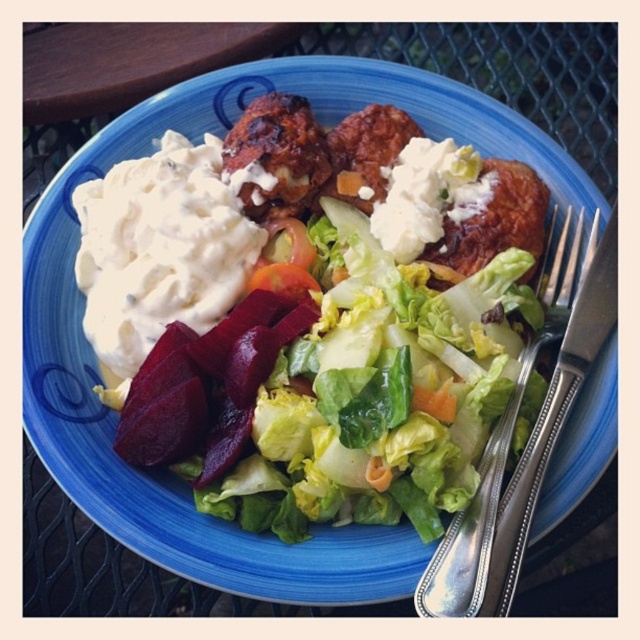
Which is in front, point (420, 312) or point (333, 188)?

Point (420, 312) is more forward.

Can you confirm if matte green lettuce at center is thinner than brown crispy meat at center?

Incorrect, matte green lettuce at center's width is not less than brown crispy meat at center's.

This screenshot has width=640, height=640. I want to click on matte green lettuce at center, so click(x=332, y=387).

Is the position of matte green lettuce at center less distant than that of slightly charred meat at center?

Yes, matte green lettuce at center is in front of slightly charred meat at center.

Does point (196, 484) come behind point (468, 256)?

That is False.

At what (x,y) coordinates should I click in order to perform the action: click on matte green lettuce at center. Please return your answer as a coordinate pair (x, y). Looking at the image, I should click on (332, 387).

Based on the photo, is silver plated fork at right positioned in front of orange smooth carrot at center?

Yes, silver plated fork at right is closer to the viewer.

Who is more forward, (522, 376) or (380, 490)?

Point (380, 490)

The width and height of the screenshot is (640, 640). What are the coordinates of `silver plated fork at right` in the screenshot? It's located at (529, 436).